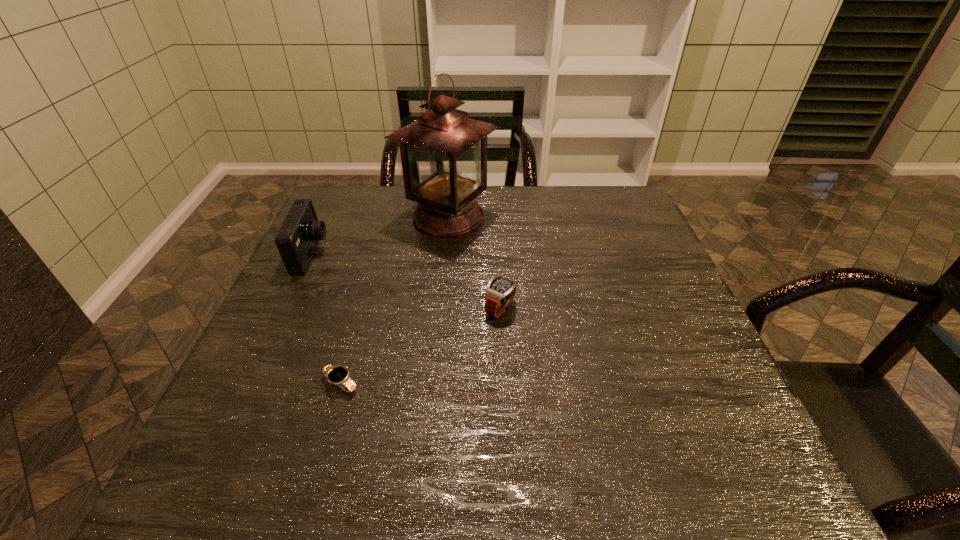
The height and width of the screenshot is (540, 960). I want to click on vacant area situated on the back of the left watch, so click(x=375, y=261).

Image resolution: width=960 pixels, height=540 pixels. Find the location of `object that is positioned at the far edge`. object that is positioned at the far edge is located at coordinates (443, 153).

Identify the location of object that is positioned at the left edge. (297, 239).

In the image, there is a desktop. What are the coordinates of `blank space at the far edge` in the screenshot? It's located at (538, 209).

This screenshot has width=960, height=540. What are the coordinates of `free space at the left edge` in the screenshot? It's located at (259, 330).

In the image, there is a desktop. Identify the location of free space at the right edge. The image size is (960, 540). (611, 237).

Locate an element on the screen. This screenshot has height=540, width=960. vacant space at the near left corner of the desktop is located at coordinates (267, 456).

Locate an element on the screen. The image size is (960, 540). free point at the far right corner is located at coordinates (593, 221).

Find the location of a particular element. The width and height of the screenshot is (960, 540). free spot between the oil lamp and the third shortest object is located at coordinates (380, 236).

Find the location of a particular element. This screenshot has height=540, width=960. free space between the farther watch and the oil lamp is located at coordinates [x=474, y=263].